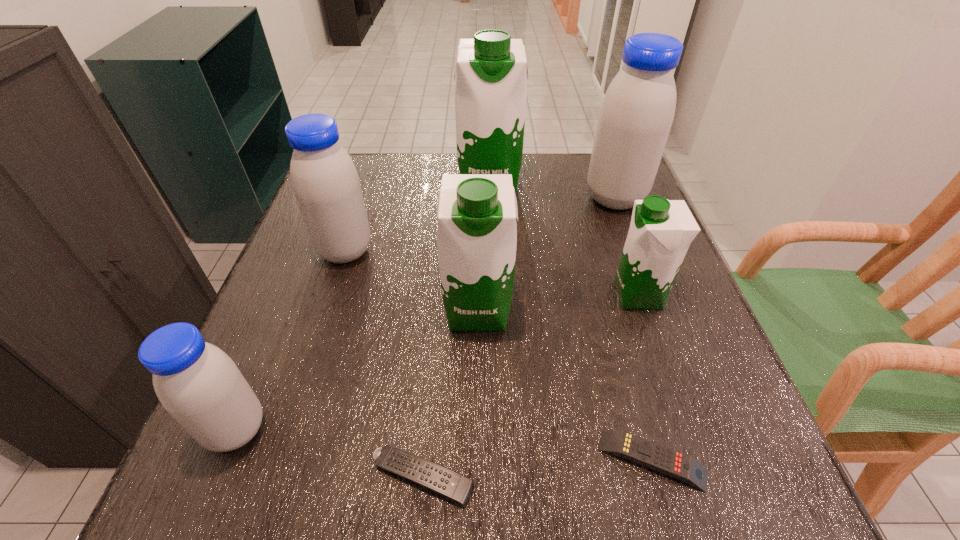
Identify which soya milk is the closest to the rightmost blue soya milk. Please provide its 2D coordinates. Your answer should be formatted as a tuple, i.e. [(x, y)], where the tuple contains the x and y coordinates of a point satisfying the conditions above.

[(491, 77)]

The image size is (960, 540). I want to click on the second closest green soya milk relative to the second smallest green soya milk, so click(x=491, y=77).

Locate an element on the screen. This screenshot has height=540, width=960. the closest green soya milk to the left remote control is located at coordinates (477, 231).

This screenshot has height=540, width=960. I want to click on blue soya milk that stands as the second closest to the nearest blue soya milk, so click(637, 112).

Locate which blue soya milk is the third closest to the second biggest green soya milk. Please provide its 2D coordinates. Your answer should be formatted as a tuple, i.e. [(x, y)], where the tuple contains the x and y coordinates of a point satisfying the conditions above.

[(637, 112)]

Locate an element on the screen. The image size is (960, 540). vacant region that satisfies the following two spatial constraints: 1. on the front-facing side of the yellow remote control; 2. on the left side of the second smallest green soya milk is located at coordinates (477, 460).

You are a GUI agent. You are given a task and a screenshot of the screen. Output one action in this format:
    pyautogui.click(x=<x>, y=<y>)
    Task: Click on the vacant space that satisfies the following two spatial constraints: 1. on the back side of the rightmost blue soya milk; 2. on the right side of the nearest soya milk
    
    Given the screenshot: What is the action you would take?
    pyautogui.click(x=331, y=198)